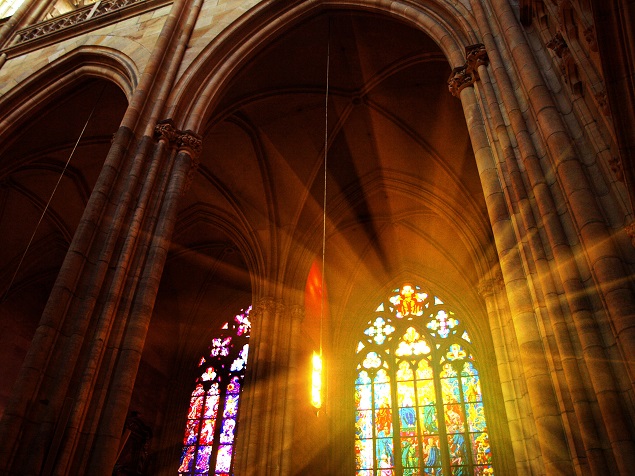
Locate an element on the screen. yellow panes of glass on right window is located at coordinates click(404, 388), click(422, 391), click(430, 372), click(397, 371).